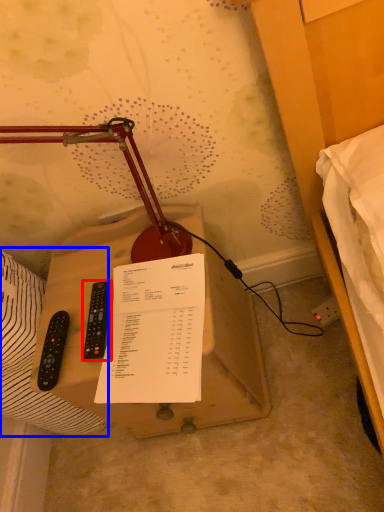
Question: Which point is further to the camera, remote control (highlighted by a red box) or sheet (highlighted by a blue box)?

Choices:
 (A) remote control
 (B) sheet

Answer: (A)